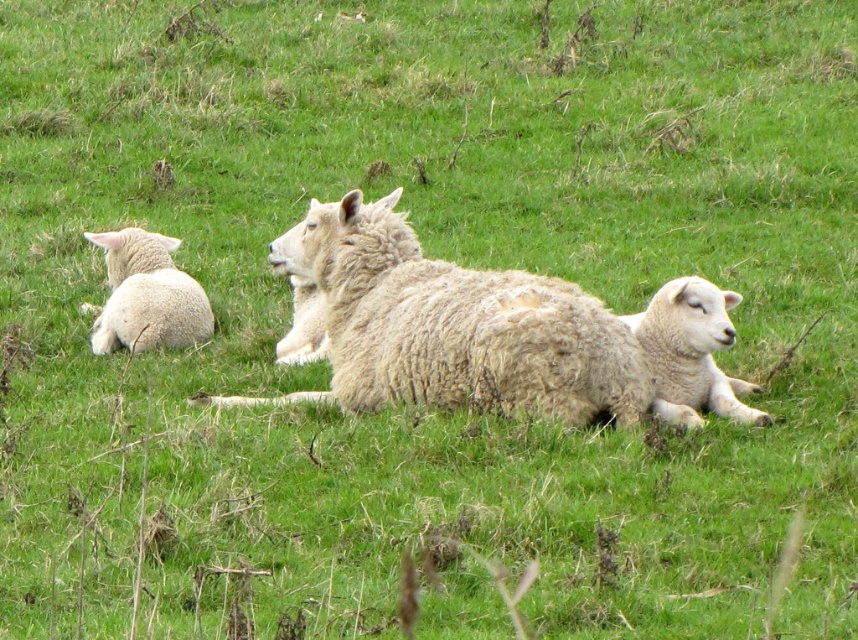
Find the location of `fuzzy white sheep at center`. fuzzy white sheep at center is located at coordinates (455, 324).

Is fuzzy white sheep at center thinner than white woolen lamb at left?

No, fuzzy white sheep at center is not thinner than white woolen lamb at left.

Who is more forward, (409, 321) or (186, 304)?

Point (409, 321)

Identify the location of fuzzy white sheep at center. Image resolution: width=858 pixels, height=640 pixels. (455, 324).

Who is taller, white woolen lamb at center or white woolen lamb at left?

With more height is white woolen lamb at left.

Can you confirm if white woolen lamb at center is positioned to the right of white woolen lamb at left?

Correct, you'll find white woolen lamb at center to the right of white woolen lamb at left.

Measure the distance between white woolen lamb at center and camera.

white woolen lamb at center is 5.79 meters from camera.

This screenshot has height=640, width=858. I want to click on white woolen lamb at center, so click(692, 353).

Between point (577, 314) and point (698, 380), which one is positioned behind?

Positioned behind is point (698, 380).

Which is below, fuzzy white sheep at center or white woolen lamb at center?

white woolen lamb at center is lower down.

Is point (635, 384) positioned behind point (672, 339)?

That is False.

Find the location of a particular element. fuzzy white sheep at center is located at coordinates (455, 324).